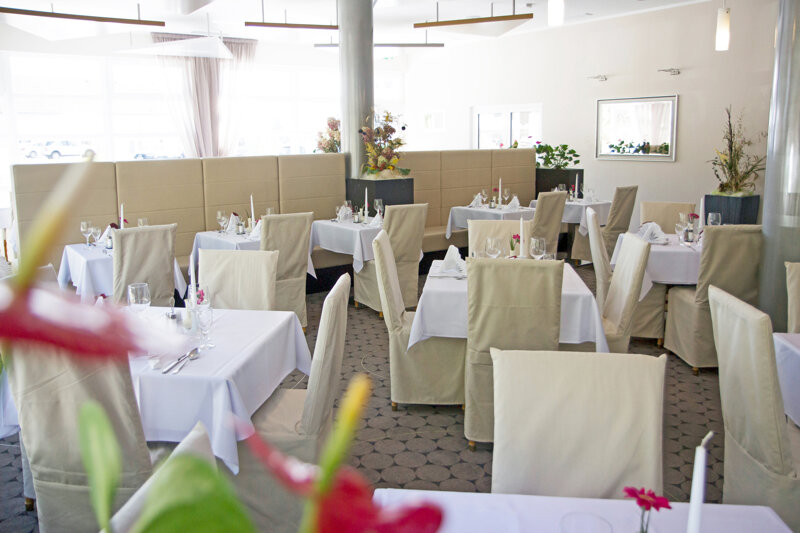
The image size is (800, 533). Find the location of `tables`. tables is located at coordinates (221, 342), (242, 246), (89, 261), (452, 302), (345, 240), (465, 212), (665, 259), (793, 352), (554, 508).